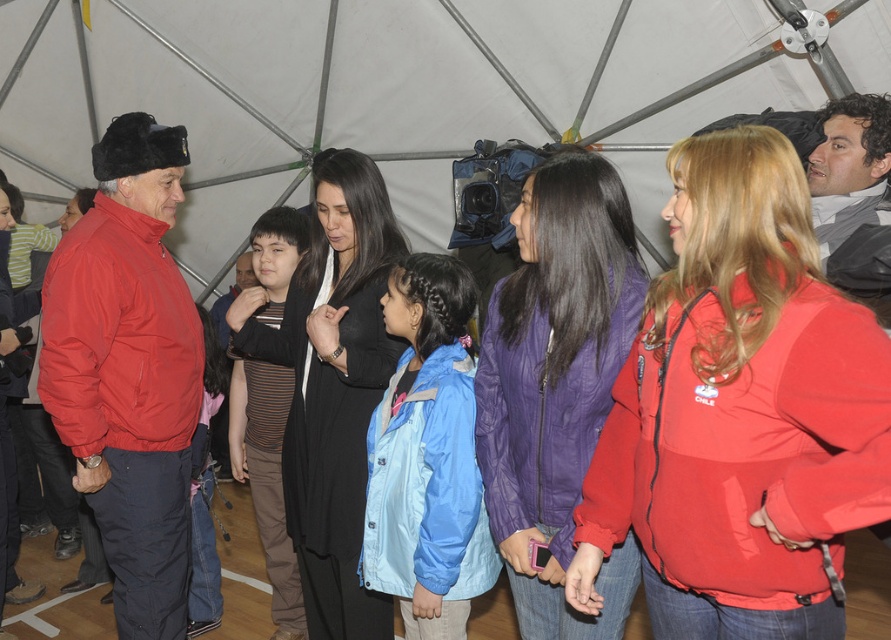
Question: Estimate the real-world distances between objects in this image. Which object is farther from the white fabric canopy at upper center?

Choices:
 (A) matte red jacket at center
 (B) purple quilted jacket at center

Answer: (A)

Question: Which point is farther to the camera?

Choices:
 (A) purple quilted jacket at center
 (B) matte red jacket at center
 (C) white fabric canopy at upper center

Answer: (C)

Question: Among these objects, which one is farthest from the camera?

Choices:
 (A) purple quilted jacket at center
 (B) matte red jacket at center
 (C) white fabric canopy at upper center

Answer: (C)

Question: Is white fabric canopy at upper center wider than matte red jacket at center?

Choices:
 (A) no
 (B) yes

Answer: (B)

Question: Is matte red jacket at center smaller than purple quilted jacket at center?

Choices:
 (A) yes
 (B) no

Answer: (B)

Question: Is matte red jacket at center above purple quilted jacket at center?

Choices:
 (A) no
 (B) yes

Answer: (B)